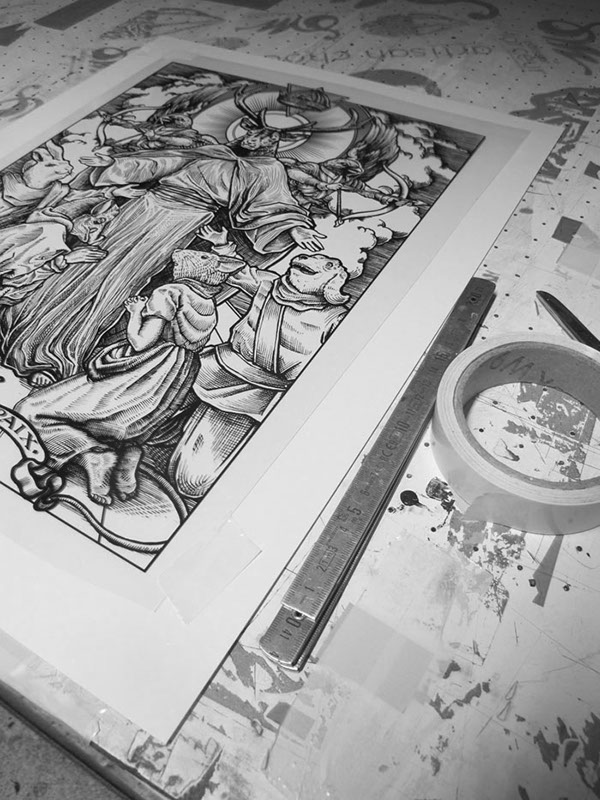
The image size is (600, 800). In order to click on roll of tape in this screenshot , I will do `click(468, 446)`.